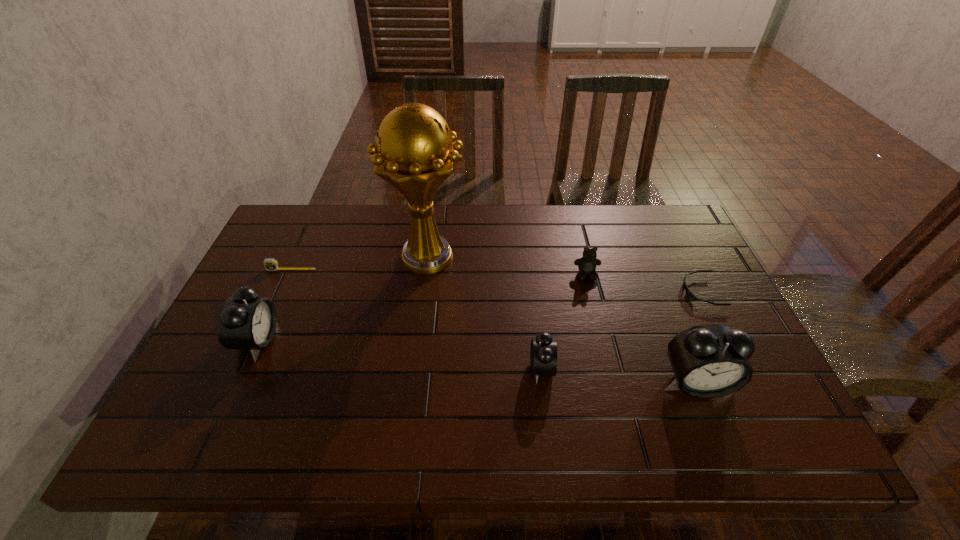
The height and width of the screenshot is (540, 960). What are the coordinates of `the closest object to the fifth object from left to right` in the screenshot? It's located at (689, 294).

At what (x,y) coordinates should I click in order to perform the action: click on object that is the third closest to the sixth tallest object. Please return your answer as a coordinate pair (x, y). This screenshot has height=540, width=960. Looking at the image, I should click on (543, 353).

At what (x,y) coordinates should I click in order to perform the action: click on alarm clock that stands as the second closest to the second shortest alarm clock. Please return your answer as a coordinate pair (x, y). Image resolution: width=960 pixels, height=540 pixels. Looking at the image, I should click on (708, 361).

Where is `alarm clock that is the closest to the fourth object from right to left`? Image resolution: width=960 pixels, height=540 pixels. alarm clock that is the closest to the fourth object from right to left is located at coordinates (708, 361).

This screenshot has width=960, height=540. What are the coordinates of `free location that satisfies the following two spatial constraints: 1. on the face of the teddy bear; 2. on the front side of the second alarm clock from right to left` in the screenshot? It's located at (610, 368).

Find the location of a particular element. The width and height of the screenshot is (960, 540). vacant space that satisfies the following two spatial constraints: 1. at the front of the tallest object where the globe is prominent; 2. on the front side of the leftmost alarm clock is located at coordinates (417, 341).